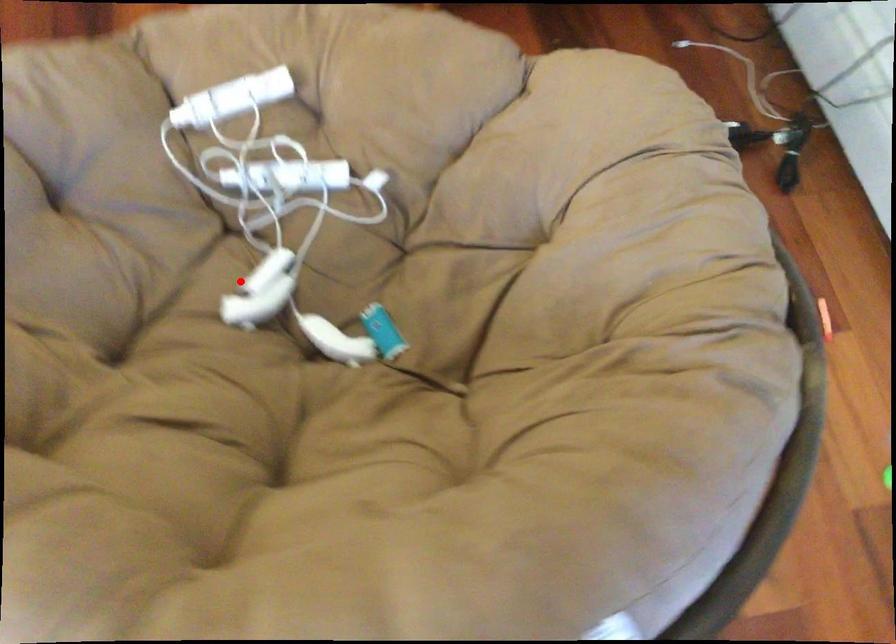
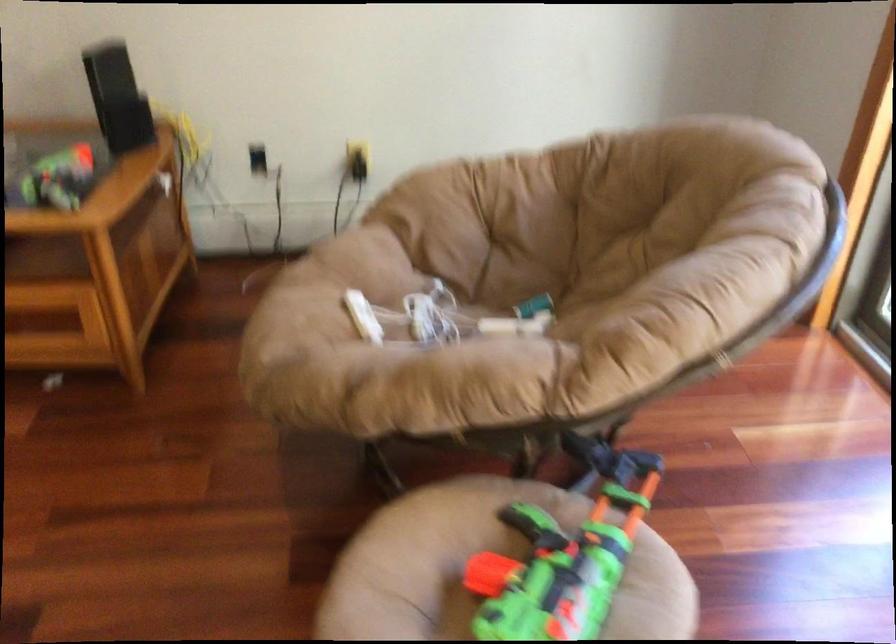
Question: I am providing you with two images of the same scene from different viewpoints. A red point is shown in image1. For the corresponding object point in image2, is it positioned nearer or farther from the camera?

Choices:
 (A) Nearer
 (B) Farther

Answer: (B)